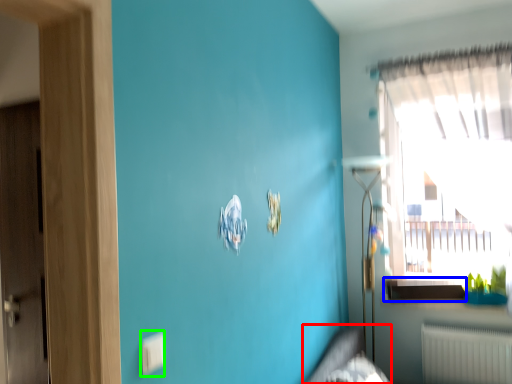
Question: Estimate the real-world distances between objects in this image. Which object is farther from bed frame (highlighted by a red box), window sill (highlighted by a blue box) or electric outlet (highlighted by a green box)?

Choices:
 (A) window sill
 (B) electric outlet

Answer: (B)